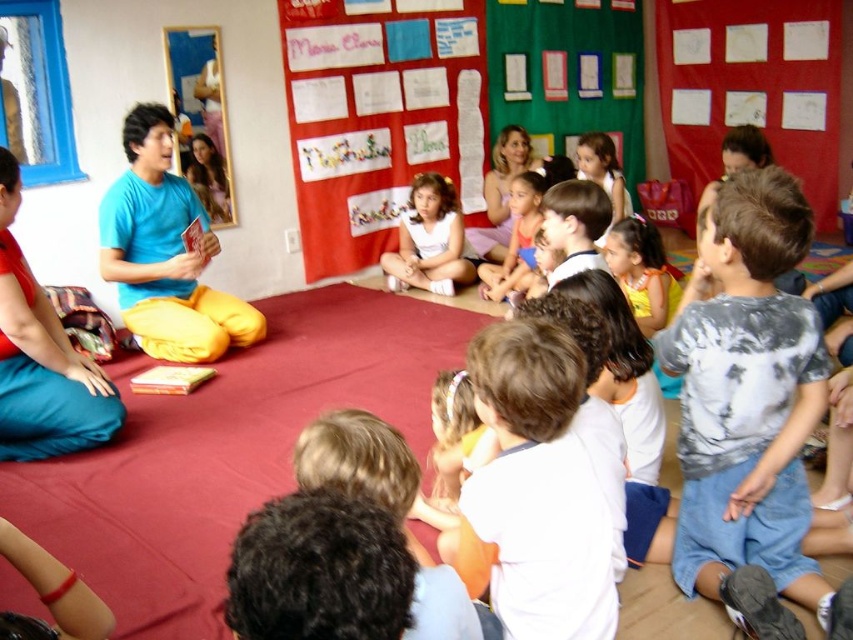
In the scene shown: You are a photographer standing at the back of the classroom. You want to take a photo of the white matte dress at center without the blue cotton shirt at upper left blocking it. Is this possible?

The blue cotton shirt at upper left is in front of the white matte dress at center, so it would block the view. Move to a position where the blue cotton shirt at upper left is not between you and the white matte dress at center to capture the dress without obstruction.

You are a teacher in the classroom and you need to locate two children. One is wearing a white cotton shirt at lower center and the other is wearing a matte pink dress at center. Which child is positioned more to the left side of the classroom?

The white cotton shirt at lower center is positioned to the left of the matte pink dress at center, so the child wearing the white cotton shirt at lower center is more to the left.